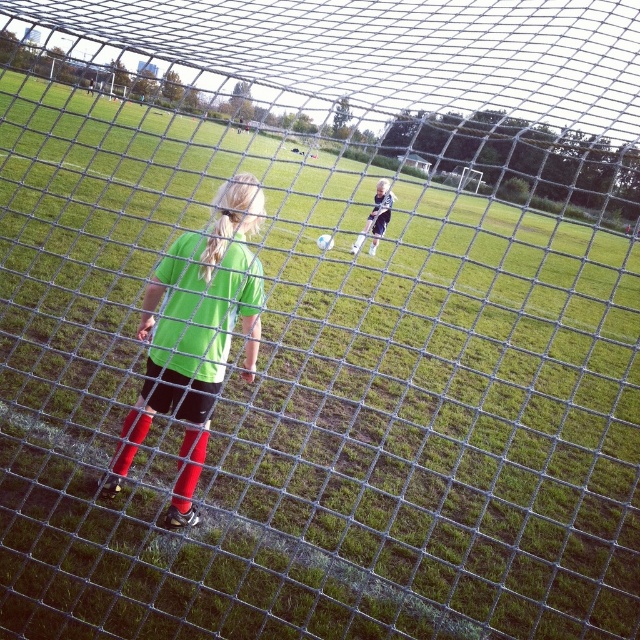
Question: In this image, where is green matte shirt at center located relative to dark blue jersey at center?

Choices:
 (A) below
 (B) above

Answer: (A)

Question: Which point is closer to the camera taking this photo?

Choices:
 (A) (204, 429)
 (B) (371, 218)

Answer: (A)

Question: Is green matte shirt at center to the right of dark blue jersey at center from the viewer's perspective?

Choices:
 (A) yes
 (B) no

Answer: (B)

Question: Among these objects, which one is nearest to the camera?

Choices:
 (A) green matte shirt at center
 (B) dark blue jersey at center

Answer: (A)

Question: Can you confirm if green matte shirt at center is positioned to the right of dark blue jersey at center?

Choices:
 (A) no
 (B) yes

Answer: (A)